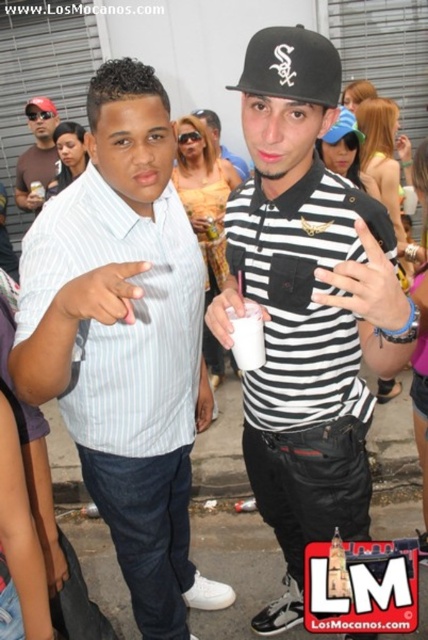
Consider the image. You are taking a photo of the two people in the scene. You want to ensure that both the white striped shirt at left and the matte black cap at upper left are clearly visible in the frame. Which one should you position closer to the center of the camera frame to achieve this?

The white striped shirt at left is to the right of the matte black cap at upper left, so positioning the white striped shirt at left closer to the center would ensure both elements remain in frame while emphasizing the shirt, but since the cap is at upper left, centering the shirt might still keep the cap visible. Alternatively, centering the cap might require adjusting the frame more. However, based on their positions, to include both clearly, the optimal would be to center between them. However, the exact

You are a photographer trying to capture a group photo of the two people in the scene. The minimum distance required between subjects for clear focus is 10 feet. Based on the distance between the white striped shirt at left and the matte black cap at upper left, can you safely take the photo without risking blur?

The white striped shirt at left and matte black cap at upper left are 9.65 feet apart, which is less than the required 10 feet for clear focus. Therefore, taking the photo might result in blur due to the insufficient distance between them.

You are a photographer trying to capture a candid shot of the white striped shirt at left and the matte black cap at upper left. Since you want to ensure both are visible in the frame, can you determine which one is closer to the camera?

The white striped shirt at left is in front of the matte black cap at upper left, so it is closer to the camera.